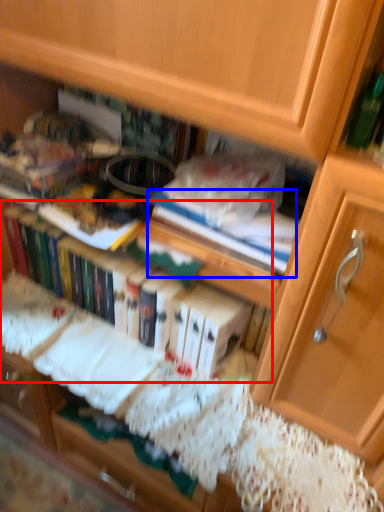
Question: Which point is further to the camera, book (highlighted by a red box) or paperback book (highlighted by a blue box)?

Choices:
 (A) book
 (B) paperback book

Answer: (A)